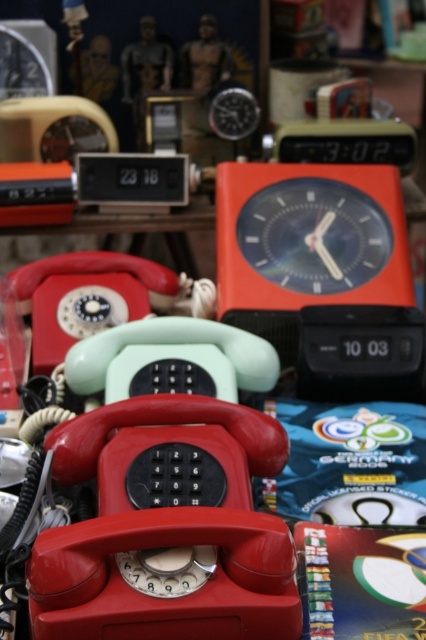
Question: Based on their relative distances, which object is farther from the matte red telephone at center?

Choices:
 (A) matte plastic telephone at center
 (B) matte orange alarm clock at center
 (C) metallic silver clock at upper center

Answer: (C)

Question: Which point is closer to the camera?

Choices:
 (A) (17, 84)
 (B) (233, 627)

Answer: (B)

Question: Which point is farther to the camera?

Choices:
 (A) (109, 225)
 (B) (405, 387)
 (C) (20, 67)
 (D) (290, 227)

Answer: (C)

Question: From the image, what is the correct spatial relationship of matte orange alarm clock at center in relation to matte plastic telephone at center?

Choices:
 (A) above
 (B) below

Answer: (B)

Question: Does matte plastic telephone at center come in front of metallic silver clock at upper center?

Choices:
 (A) yes
 (B) no

Answer: (A)

Question: Does matte plastic telephone at center have a lesser width compared to metallic silver clock at upper left?

Choices:
 (A) yes
 (B) no

Answer: (B)